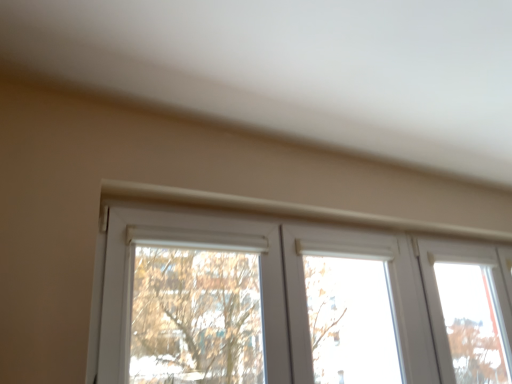
What is the approximate height of white plastic window at center?

It is 30.89 inches.

What do you see at coordinates (295, 302) in the screenshot? This screenshot has height=384, width=512. I see `white plastic window at center` at bounding box center [295, 302].

Image resolution: width=512 pixels, height=384 pixels. Find the location of `white plastic window at center`. white plastic window at center is located at coordinates (295, 302).

At what (x,y) coordinates should I click in order to perform the action: click on white plastic window at center. Please return your answer as a coordinate pair (x, y). The image size is (512, 384). Looking at the image, I should click on (295, 302).